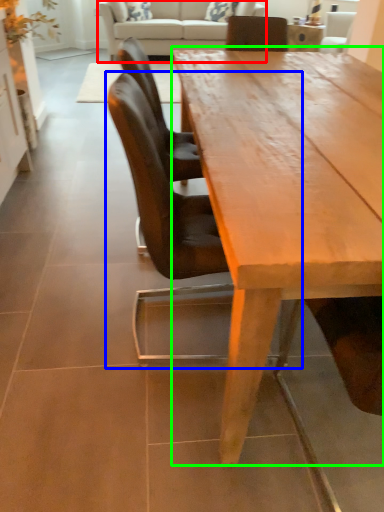
Question: Based on their relative distances, which object is nearer to studio couch (highlighted by a red box)? Choose from chair (highlighted by a blue box) and coffee table (highlighted by a green box).

Choices:
 (A) chair
 (B) coffee table

Answer: (B)